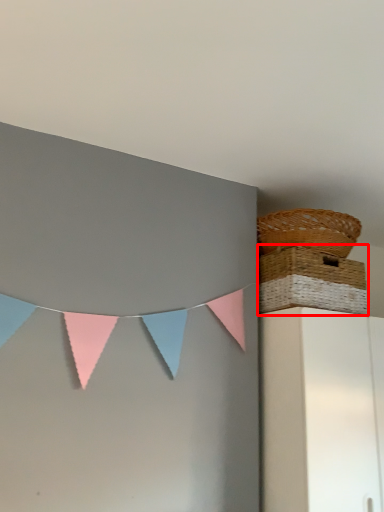
Question: Considering the relative positions of picnic basket (annotated by the red box) and picnic basket in the image provided, where is picnic basket (annotated by the red box) located with respect to the staircase?

Choices:
 (A) left
 (B) right

Answer: (A)